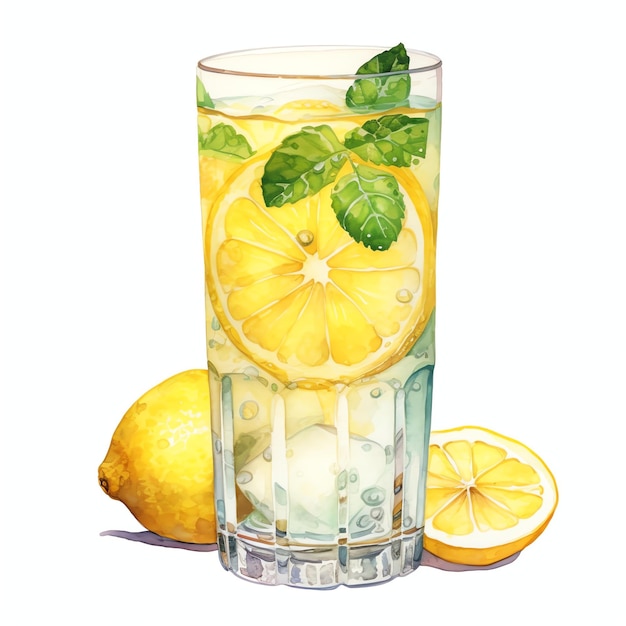
At what (x,y) coordinates should I click in order to perform the action: click on rim of glass. Please return your answer as a coordinate pair (x, y). Image resolution: width=626 pixels, height=626 pixels. Looking at the image, I should click on (220, 54), (322, 77).